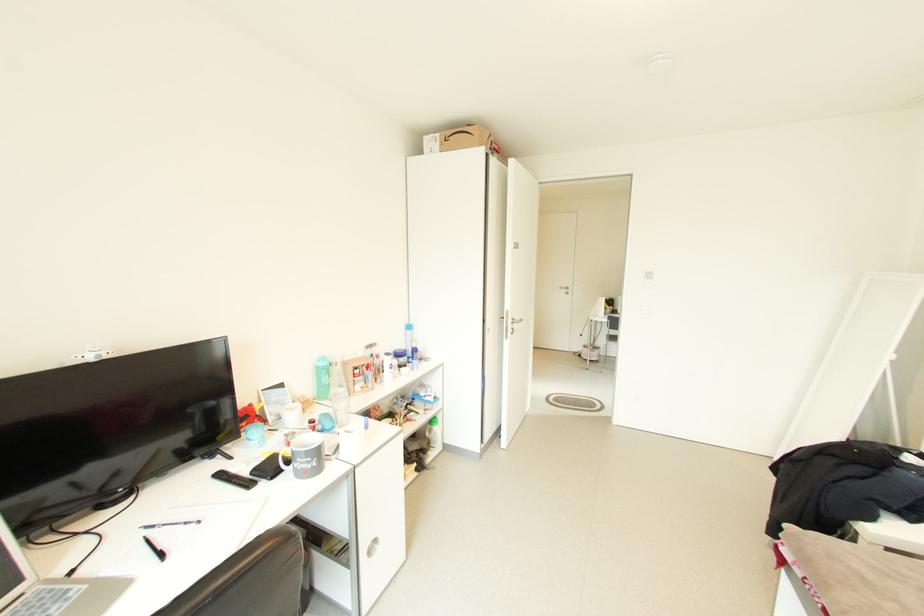
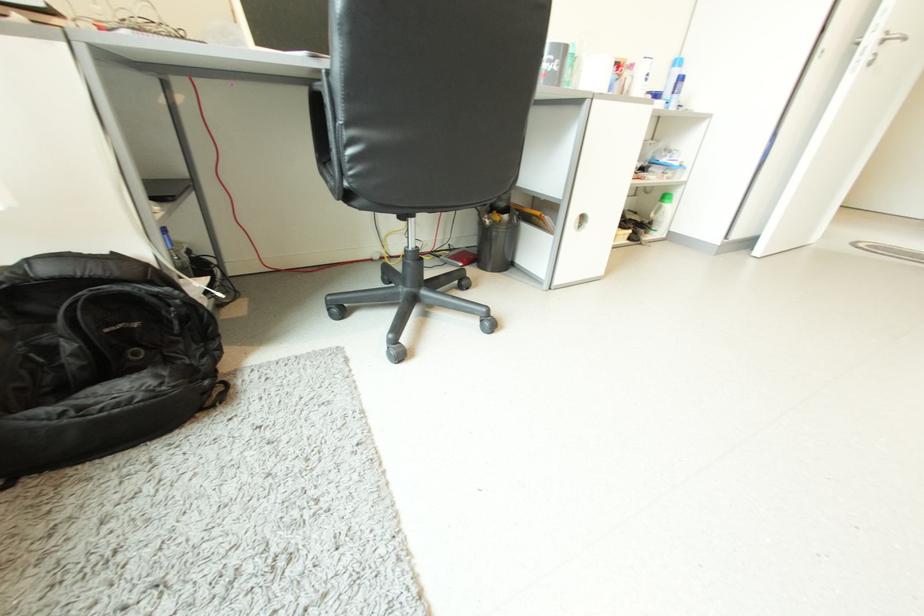
Find the pixel in the second image that matches point 314,466 in the first image.

(553, 68)